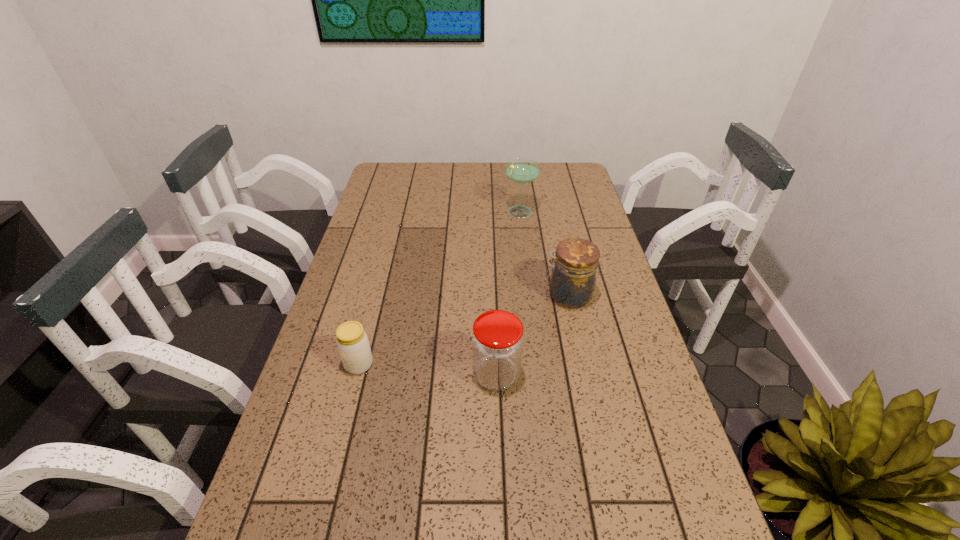
This screenshot has width=960, height=540. Find the location of `vacant region located 0.130m on the right of the second jar from left to right`. vacant region located 0.130m on the right of the second jar from left to right is located at coordinates (576, 375).

Find the location of a particular element. The image size is (960, 540). free spot located 0.100m on the front of the leftmost jar is located at coordinates [x=347, y=414].

Where is `object located at the left edge`? Image resolution: width=960 pixels, height=540 pixels. object located at the left edge is located at coordinates (352, 341).

The width and height of the screenshot is (960, 540). What are the coordinates of `object located in the right edge section of the desktop` in the screenshot? It's located at (573, 278).

Where is `free space at the left edge of the desktop`? This screenshot has height=540, width=960. free space at the left edge of the desktop is located at coordinates (296, 429).

Locate an element on the screen. The height and width of the screenshot is (540, 960). free space at the right edge is located at coordinates (603, 408).

Image resolution: width=960 pixels, height=540 pixels. Find the location of `vacant space at the far left corner`. vacant space at the far left corner is located at coordinates (413, 176).

The image size is (960, 540). Identify the location of vacant space at the far right corner of the desktop. (548, 170).

Locate an element on the screen. vacant space in between the shortest object and the rightmost jar is located at coordinates (464, 330).

Locate an element on the screen. The height and width of the screenshot is (540, 960). free spot between the second jar from left to right and the rightmost jar is located at coordinates (532, 335).